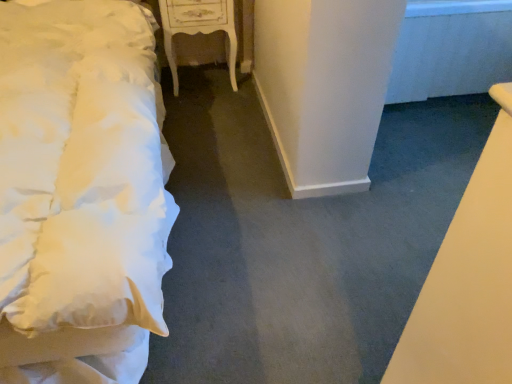
Question: Does white soft bed at left appear on the left side of white glossy nightstand at center?

Choices:
 (A) no
 (B) yes

Answer: (B)

Question: Is the position of white soft bed at left more distant than that of white glossy nightstand at center?

Choices:
 (A) yes
 (B) no

Answer: (B)

Question: Does white soft bed at left have a larger size compared to white glossy nightstand at center?

Choices:
 (A) yes
 (B) no

Answer: (A)

Question: Can you confirm if white soft bed at left is shorter than white glossy nightstand at center?

Choices:
 (A) no
 (B) yes

Answer: (A)

Question: Is the surface of white soft bed at left in direct contact with white glossy nightstand at center?

Choices:
 (A) yes
 (B) no

Answer: (B)

Question: Is white soft bed at left outside of white glossy nightstand at center?

Choices:
 (A) no
 (B) yes

Answer: (B)

Question: Does white glossy nightstand at center have a greater height compared to white soft bed at left?

Choices:
 (A) yes
 (B) no

Answer: (B)

Question: Can we say white glossy nightstand at center lies outside white soft bed at left?

Choices:
 (A) no
 (B) yes

Answer: (B)

Question: Is white glossy nightstand at center facing towards white soft bed at left?

Choices:
 (A) yes
 (B) no

Answer: (B)

Question: From the image's perspective, is white glossy nightstand at center on white soft bed at left?

Choices:
 (A) no
 (B) yes

Answer: (B)

Question: From a real-world perspective, is white glossy nightstand at center physically below white soft bed at left?

Choices:
 (A) no
 (B) yes

Answer: (B)

Question: Is white glossy nightstand at center shorter than white soft bed at left?

Choices:
 (A) no
 (B) yes

Answer: (B)

Question: Looking at their shapes, would you say white glossy nightstand at center is wider or thinner than white soft bed at left?

Choices:
 (A) wide
 (B) thin

Answer: (B)